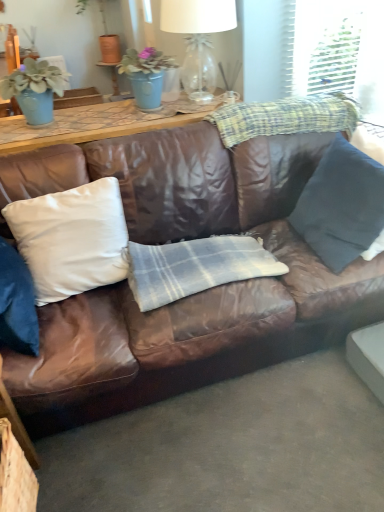
Question: Should I look upward or downward to see white satin pillow at center, the first pillow in the left-to-right sequence?

Choices:
 (A) up
 (B) down

Answer: (A)

Question: Does brown leather couch at center have a greater height compared to white satin pillow at center, which is the 2th pillow from right to left?

Choices:
 (A) no
 (B) yes

Answer: (B)

Question: Does brown leather couch at center turn towards white satin pillow at center, the first pillow in the left-to-right sequence?

Choices:
 (A) yes
 (B) no

Answer: (A)

Question: From the image's perspective, is brown leather couch at center on white satin pillow at center, which is the 2th pillow from right to left?

Choices:
 (A) yes
 (B) no

Answer: (A)

Question: Is the position of brown leather couch at center less distant than that of white satin pillow at center, the first pillow in the left-to-right sequence?

Choices:
 (A) no
 (B) yes

Answer: (B)

Question: Considering the relative positions of brown leather couch at center and white satin pillow at center, which is the 2th pillow from right to left, in the image provided, is brown leather couch at center to the right of white satin pillow at center, which is the 2th pillow from right to left, from the viewer's perspective?

Choices:
 (A) yes
 (B) no

Answer: (A)

Question: Is brown leather couch at center not near white satin pillow at center, which is the 2th pillow from right to left?

Choices:
 (A) no
 (B) yes

Answer: (A)

Question: From a real-world perspective, is clear glass lampshade at upper center under dark blue fabric pillow at right, the second pillow when ordered from left to right?

Choices:
 (A) yes
 (B) no

Answer: (B)

Question: Is clear glass lampshade at upper center positioned behind dark blue fabric pillow at right, the second pillow when ordered from left to right?

Choices:
 (A) yes
 (B) no

Answer: (A)

Question: Is clear glass lampshade at upper center at the right side of dark blue fabric pillow at right, placed as the 1th pillow when sorted from right to left?

Choices:
 (A) no
 (B) yes

Answer: (A)

Question: Considering the relative sizes of clear glass lampshade at upper center and dark blue fabric pillow at right, placed as the 1th pillow when sorted from right to left, in the image provided, is clear glass lampshade at upper center wider than dark blue fabric pillow at right, placed as the 1th pillow when sorted from right to left,?

Choices:
 (A) yes
 (B) no

Answer: (A)

Question: Is clear glass lampshade at upper center far from dark blue fabric pillow at right, placed as the 1th pillow when sorted from right to left?

Choices:
 (A) no
 (B) yes

Answer: (B)

Question: From the image's perspective, would you say clear glass lampshade at upper center is shown under dark blue fabric pillow at right, the second pillow when ordered from left to right?

Choices:
 (A) yes
 (B) no

Answer: (B)

Question: Does dark blue fabric pillow at right, the second pillow when ordered from left to right, have a larger size compared to clear glass lampshade at upper center?

Choices:
 (A) yes
 (B) no

Answer: (B)